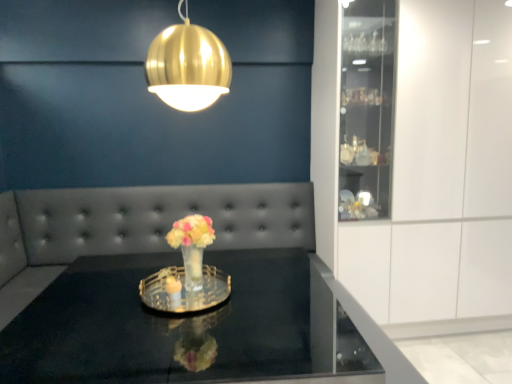
The image size is (512, 384). I want to click on space that is in front of clear glass tray at center, so click(x=173, y=337).